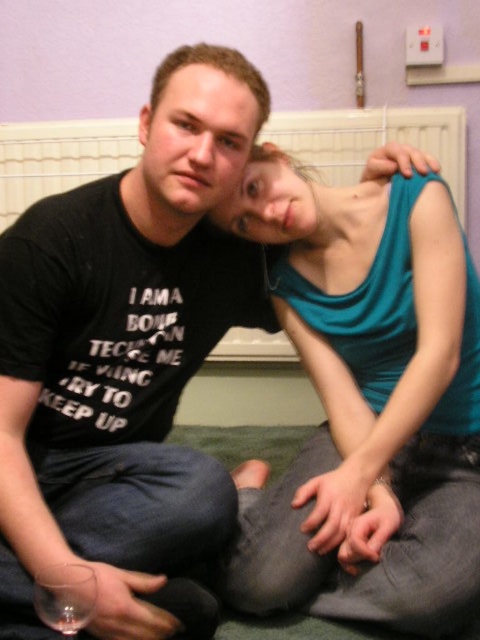
Who is positioned more to the left, teal fabric tank top at upper right or white plastic radiator at upper center?

teal fabric tank top at upper right is more to the left.

Is teal fabric tank top at upper right positioned before white plastic radiator at upper center?

That is True.

Who is more distant from viewer, (447, 260) or (48, 147)?

Point (48, 147)

What are the coordinates of `teal fabric tank top at upper right` in the screenshot? It's located at (368, 403).